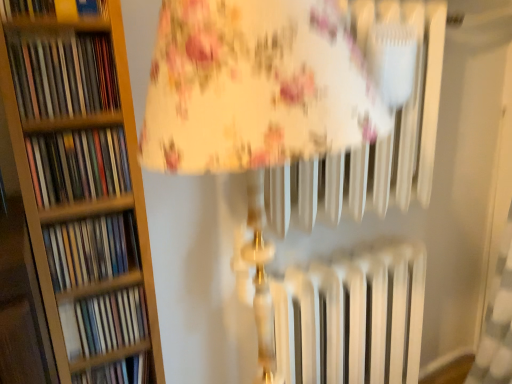
Question: Looking at their shapes, would you say hardcover book at upper left, the 6th book when ordered from bottom to top, is wider or thinner than matte plastic book at left, the 2th book positioned from the bottom?

Choices:
 (A) wide
 (B) thin

Answer: (A)

Question: From a real-world perspective, is hardcover book at upper left, the 6th book when ordered from bottom to top, above or below matte plastic book at left, the 2th book positioned from the bottom?

Choices:
 (A) above
 (B) below

Answer: (A)

Question: Estimate the real-world distances between objects in this image. Which object is closer to the matte cardboard book at left, which appears as the first book when ordered from the bottom?

Choices:
 (A) matte plastic books at left, which is the fourth book in top-to-bottom order
 (B) matte plastic books at left, which is counted as the 5th book, starting from the bottom
 (C) matte plastic book at left, the fifth book in the top-to-bottom sequence
 (D) multicolored paperbacks at left, the third book in the top-to-bottom sequence
 (E) hardcover book at upper left, the 6th book when ordered from bottom to top

Answer: (C)

Question: Estimate the real-world distances between objects in this image. Which object is closer to the matte plastic books at left, which is counted as the 5th book, starting from the bottom?

Choices:
 (A) matte plastic books at left, which is the fourth book in top-to-bottom order
 (B) multicolored paperbacks at left, the third book in the top-to-bottom sequence
 (C) matte cardboard book at left, which appears as the first book when ordered from the bottom
 (D) matte plastic book at left, the 2th book positioned from the bottom
 (E) hardcover book at upper left, the first book from the top

Answer: (E)